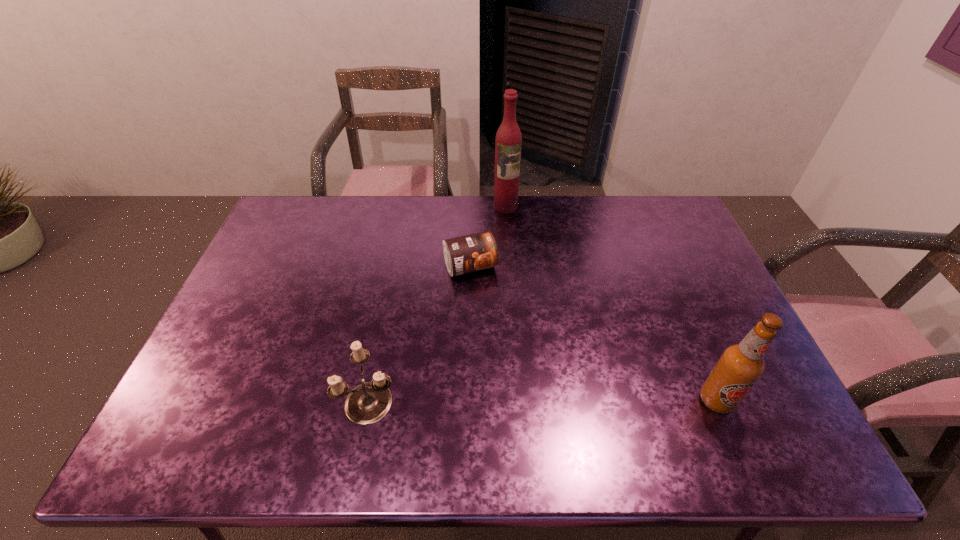
Find the location of a particular element. This screenshot has width=960, height=540. the third tallest object is located at coordinates (369, 402).

At what (x,y) coordinates should I click in order to perform the action: click on candle holder. Please return your answer as a coordinate pair (x, y). Looking at the image, I should click on (369, 402).

Identify the location of beer bottle. The height and width of the screenshot is (540, 960). (740, 366).

This screenshot has width=960, height=540. I want to click on the third shortest object, so click(740, 366).

At what (x,y) coordinates should I click in order to perform the action: click on the farthest object. Please return your answer as a coordinate pair (x, y). The image size is (960, 540). Looking at the image, I should click on (508, 142).

The height and width of the screenshot is (540, 960). Find the location of `the tallest object`. the tallest object is located at coordinates [x=508, y=142].

You are a GUI agent. You are given a task and a screenshot of the screen. Output one action in this format:
    pyautogui.click(x=<x>, y=<y>)
    Task: Click on the third nearest object
    
    Given the screenshot: What is the action you would take?
    pyautogui.click(x=478, y=251)

The height and width of the screenshot is (540, 960). I want to click on can, so click(478, 251).

Where is `free space located 0.240m on the back of the leftmost object`? The height and width of the screenshot is (540, 960). free space located 0.240m on the back of the leftmost object is located at coordinates (390, 305).

Where is `free point located on the label of the tallest object`? The width and height of the screenshot is (960, 540). free point located on the label of the tallest object is located at coordinates (531, 267).